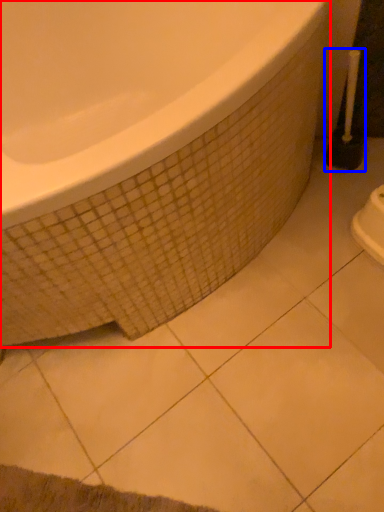
Question: Which point is closer to the camera, bathtub (highlighted by a red box) or brush (highlighted by a blue box)?

Choices:
 (A) bathtub
 (B) brush

Answer: (A)